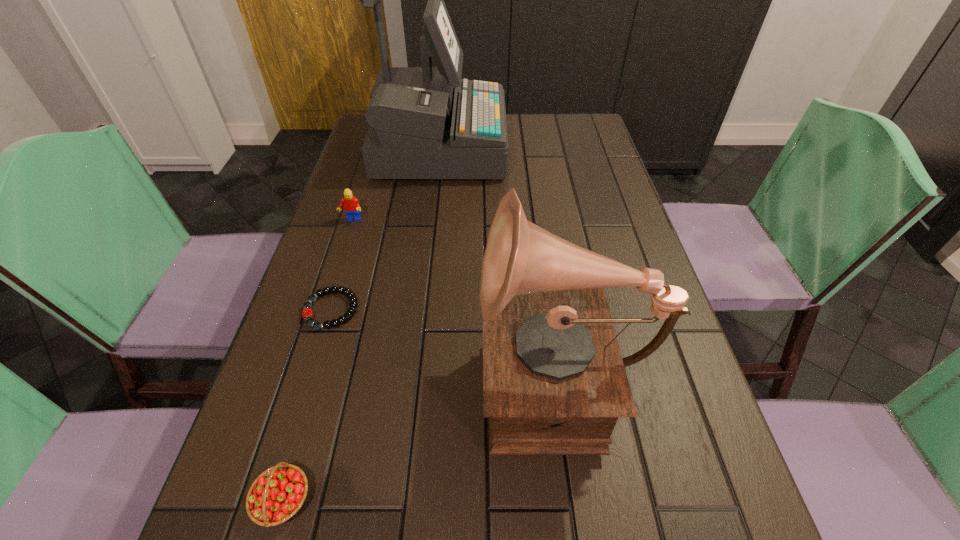
The image size is (960, 540). I want to click on the farthest object, so click(x=426, y=122).

At what (x,y) coordinates should I click in order to perform the action: click on record player. Please return your answer as a coordinate pair (x, y). The width and height of the screenshot is (960, 540). Looking at the image, I should click on (554, 382).

Where is `the second farthest object`? Image resolution: width=960 pixels, height=540 pixels. the second farthest object is located at coordinates (351, 205).

Locate an element on the screen. This screenshot has height=540, width=960. the third tallest object is located at coordinates (351, 205).

Image resolution: width=960 pixels, height=540 pixels. Find the location of `the nearest object`. the nearest object is located at coordinates (277, 494).

In order to click on the second shortest object in this screenshot , I will do `click(277, 494)`.

You are a GUI agent. You are given a task and a screenshot of the screen. Output one action in this format:
    pyautogui.click(x=<x>, y=<y>)
    Task: Click on the shortest object
    Image resolution: width=960 pixels, height=540 pixels.
    Given the screenshot: What is the action you would take?
    pyautogui.click(x=307, y=313)

Find the location of a particular element. The height and width of the screenshot is (540, 960). free space located 0.280m on the customer-facing side of the farthest object is located at coordinates (594, 148).

Image resolution: width=960 pixels, height=540 pixels. Identify the location of vacant space located 0.320m on the horn of the record player. (307, 372).

This screenshot has width=960, height=540. In order to click on vacant region located on the horn of the record player in this screenshot , I will do `click(399, 372)`.